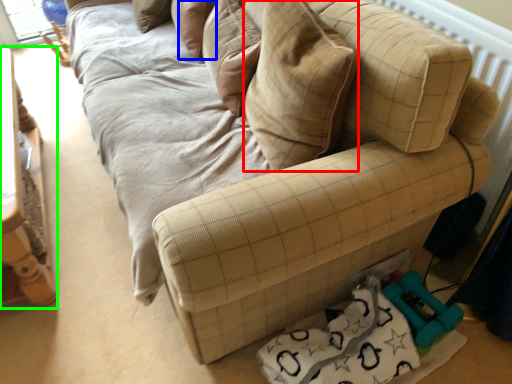
Question: Which object is the farthest from throw pillow (highlighted by a red box)? Choose among these: pillow (highlighted by a blue box) or furniture (highlighted by a green box).

Choices:
 (A) pillow
 (B) furniture

Answer: (B)